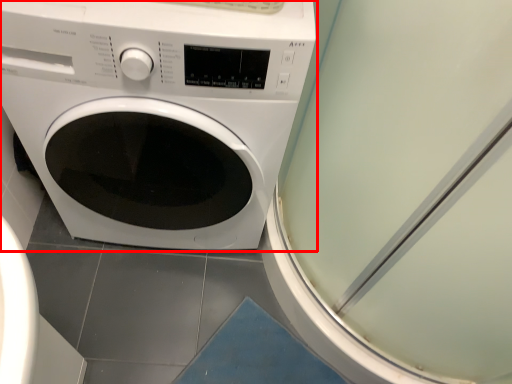
Question: From the image's perspective, where is washing machine (annotated by the red box) located in relation to screen door in the image?

Choices:
 (A) below
 (B) above

Answer: (B)